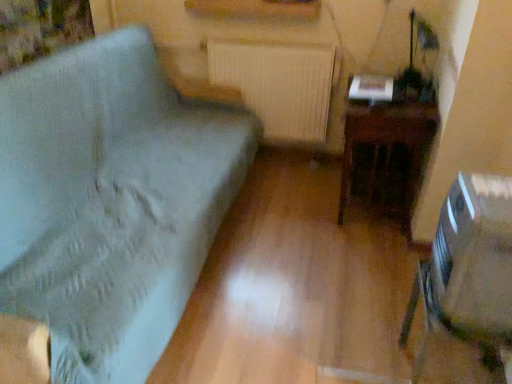
Find the location of a particular element. The image size is (512, 384). free space to the left of dark wood table at right is located at coordinates (283, 205).